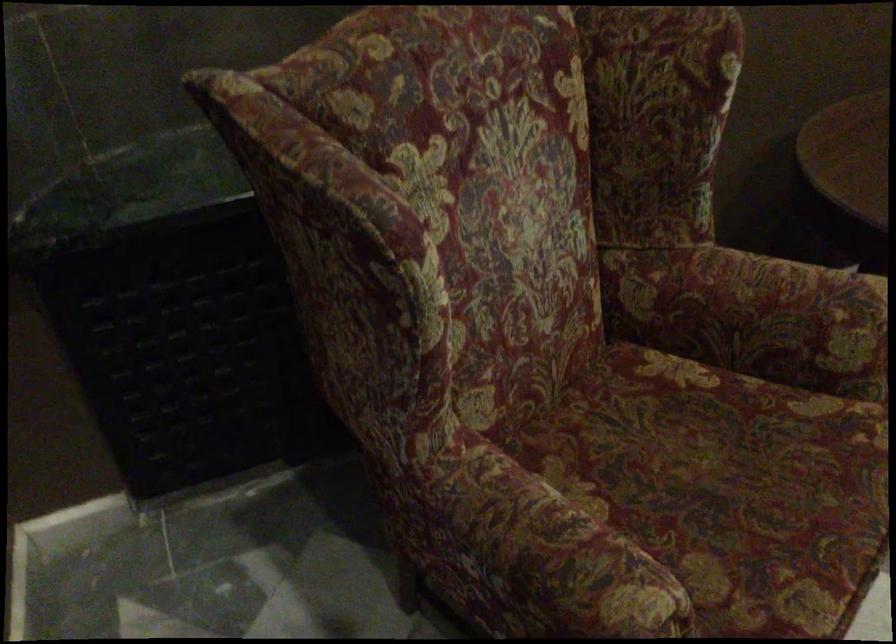
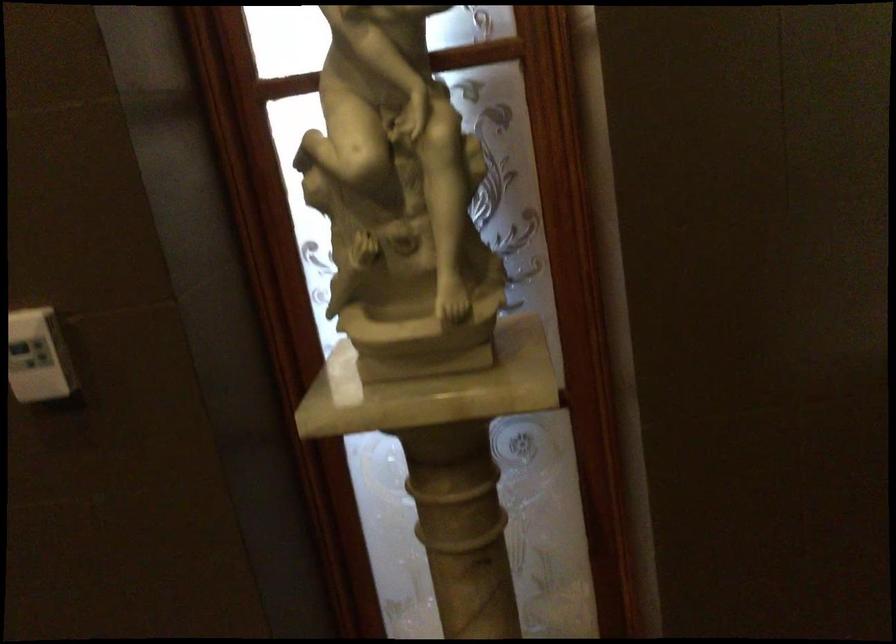
First-person continuous shooting, in which direction is the camera rotating?

The camera rotated toward left-down.